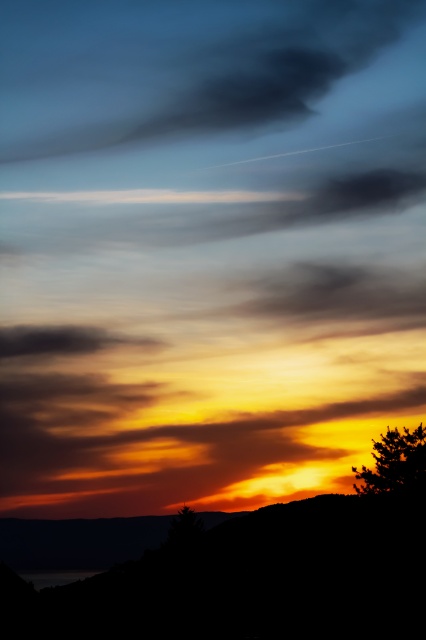
You are an astronomer observing the sunset and want to compare the sizes of the silhouette tree at lower right and the dark matte cloud at center. Which object appears larger in the image?

The dark matte cloud at center appears larger than the silhouette tree at lower right in the image.

You are standing in the sunset scene and want to walk from the point at coordinates [322,218] to the point at coordinates [114,346]. Which direction should you move relative to your current position?

You should move towards the lower right direction because point [114,346] is closer to the horizon and lower in the frame compared to point [322,218].

You are an artist trying to paint the sunset scene. You want to ensure the silhouette tree at lower right and the dark matte cloud at center are positioned correctly. Based on their relative positions, which object should appear larger in your painting?

The silhouette tree at lower right should appear larger in the painting because it is closer to the viewer than the dark matte cloud at center.